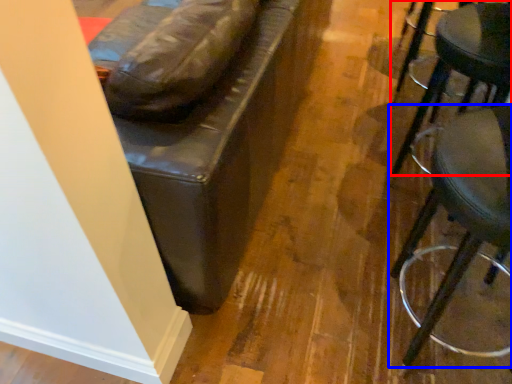
Question: Which point is closer to the camera, stool (highlighted by a red box) or stool (highlighted by a blue box)?

Choices:
 (A) stool
 (B) stool

Answer: (B)